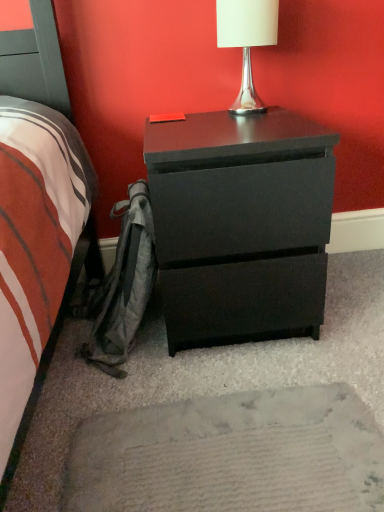
Where is `vacant space to the right of matte black chest of drawers at center`? vacant space to the right of matte black chest of drawers at center is located at coordinates (352, 295).